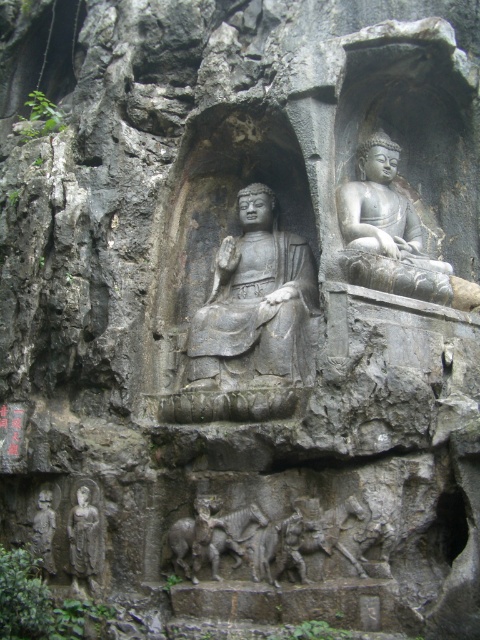
How much distance is there between dark gray stone relief at center and gray stone statue at lower left?

A distance of 6.50 meters exists between dark gray stone relief at center and gray stone statue at lower left.

Describe the element at coordinates (276, 541) in the screenshot. The height and width of the screenshot is (640, 480). I see `dark gray stone relief at center` at that location.

Is point (262, 564) positioned behind point (35, 548)?

No, it is in front of (35, 548).

This screenshot has width=480, height=640. What are the coordinates of `dark gray stone relief at center` in the screenshot? It's located at (276, 541).

Who is more forward, [299,516] or [398,214]?

Point [299,516]

Is dark gray stone relief at center in front of gray stone buddha at upper center?

Yes, dark gray stone relief at center is closer to the viewer.

Who is more distant from viewer, (373, 522) or (417, 230)?

The point (417, 230) is behind.

Image resolution: width=480 pixels, height=640 pixels. Identify the location of dark gray stone relief at center. (276, 541).

Between gray stone statue at center and gray stone statue at lower left, which one has less height?

gray stone statue at lower left is shorter.

Who is higher up, gray stone statue at center or gray stone statue at lower left?

gray stone statue at center is higher up.

Between point (276, 204) and point (41, 545), which one is positioned behind?

Positioned behind is point (276, 204).

Find the location of a particular element. This screenshot has width=480, height=640. gray stone statue at center is located at coordinates (255, 301).